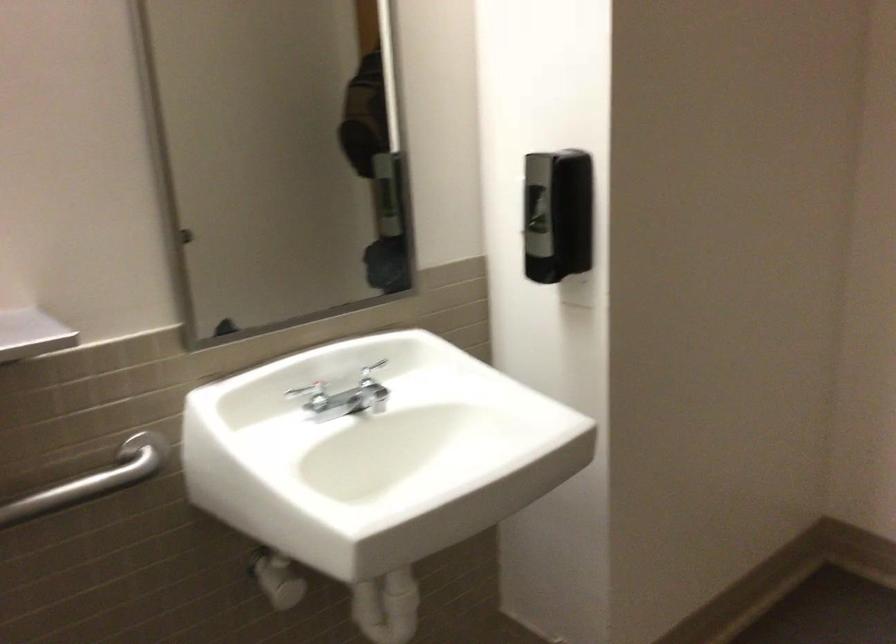
Where would you grip the metal grab bar? Please return your answer as a coordinate pair (x, y).

(92, 480)